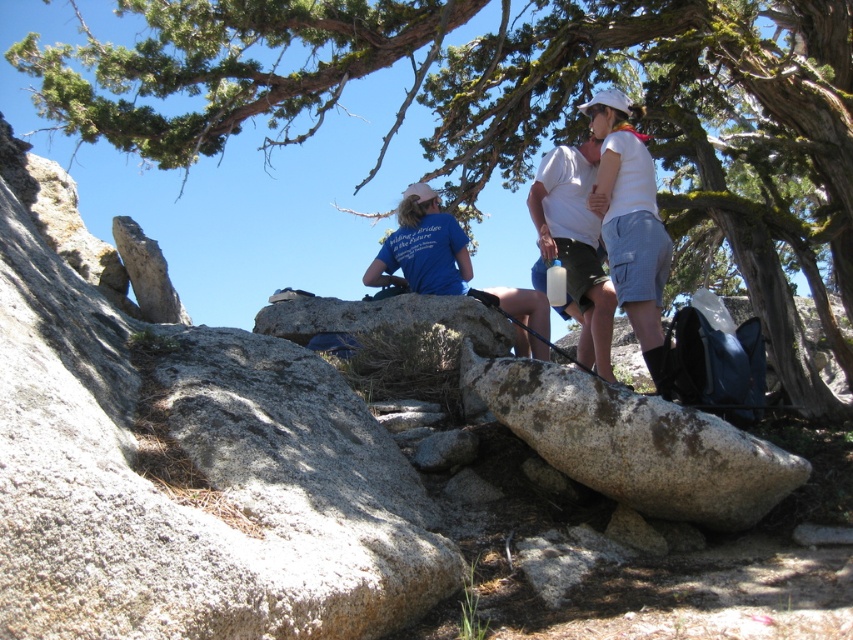
You are standing in the mountainous area and want to take a photo of both the white matte shirt at upper center and the blue fabric shirt at center. Which person should you focus on first to ensure both are in the frame?

You should focus on the white matte shirt at upper center first because it is closer to the viewer than the blue fabric shirt at center, so adjusting focus from near to far will help capture both in the frame.

You are standing at the point marked by the coordinates point (630,220). Which object are you currently standing on?

You are standing on the white cotton shirt at center.

You are a hiker who wants to take a photo of the white matte shirt at upper center and the blue fabric shirt at center. Which one is positioned higher in the frame?

The white matte shirt at upper center is positioned higher in the frame than the blue fabric shirt at center.